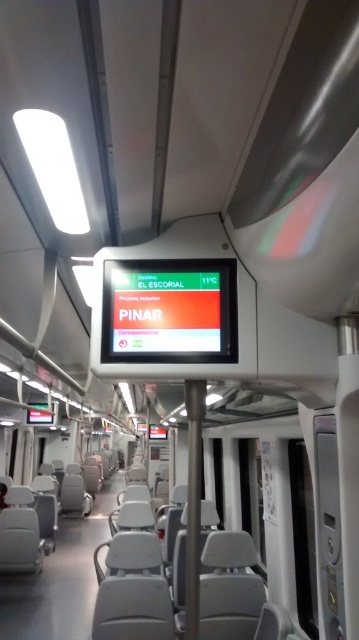
Who is higher up, matte orange display at center or metallic pole at center?

matte orange display at center

Looking at this image, which of these two, matte orange display at center or metallic pole at center, stands shorter?

Standing shorter between the two is matte orange display at center.

Describe the element at coordinates (165, 310) in the screenshot. I see `matte orange display at center` at that location.

At what (x,y) coordinates should I click in order to perform the action: click on matte orange display at center. Please return your answer as a coordinate pair (x, y). The width and height of the screenshot is (359, 640). Looking at the image, I should click on (165, 310).